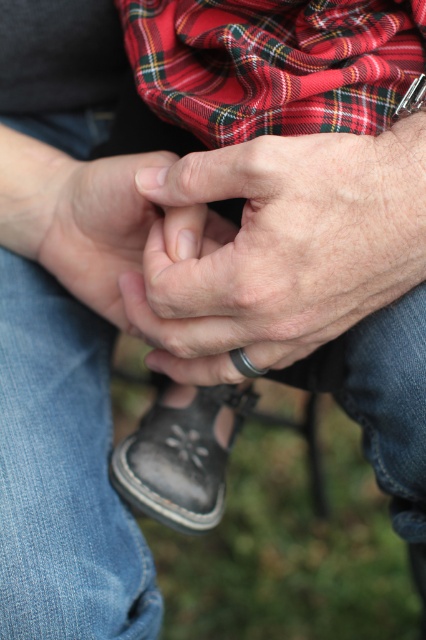
Question: Which object is farther from the camera taking this photo?

Choices:
 (A) leather sandal at lower center
 (B) red plaid scarf at upper center

Answer: (A)

Question: Can you confirm if smooth skin hand at center is smaller than leather sandal at lower center?

Choices:
 (A) no
 (B) yes

Answer: (A)

Question: Where is leather ring at center located in relation to smooth skin hand at center in the image?

Choices:
 (A) above
 (B) below

Answer: (B)

Question: Based on their relative distances, which object is nearer to the smooth skin hand at center?

Choices:
 (A) red plaid scarf at upper center
 (B) leather ring at center
 (C) leather sandal at lower center

Answer: (B)

Question: Which point appears farthest from the camera in this image?

Choices:
 (A) (290, 100)
 (B) (222, 474)
 (C) (78, 212)

Answer: (B)

Question: Can you confirm if leather ring at center is positioned above red plaid scarf at upper center?

Choices:
 (A) yes
 (B) no

Answer: (B)